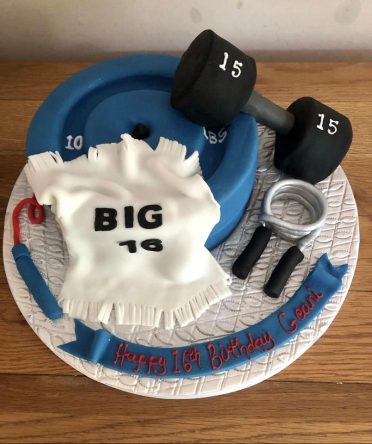
Identify the location of wooden table. This screenshot has height=444, width=372. tap(354, 87).